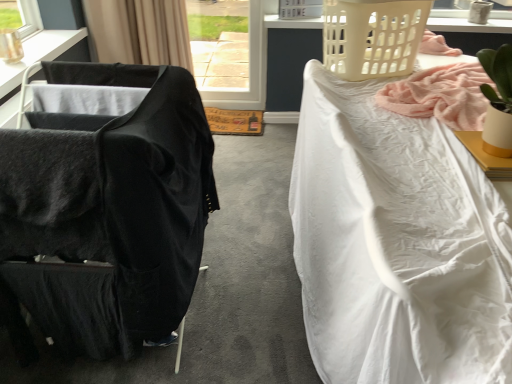
Where is `transparent glass door at center`? transparent glass door at center is located at coordinates tap(231, 55).

Find the location of a particular element. beige plastic laundry basket at upper right, the second basket viewed from the top is located at coordinates (372, 36).

Locate an element on the screen. black fabric chair at left is located at coordinates 105,209.

Image resolution: width=512 pixels, height=384 pixels. What do you see at coordinates (396, 244) in the screenshot? I see `white textured fabric at right` at bounding box center [396, 244].

This screenshot has width=512, height=384. Describe the element at coordinates (300, 9) in the screenshot. I see `white plastic laundry basket at upper center, which is the first basket from back to front` at that location.

The width and height of the screenshot is (512, 384). Identify the location of black fabric curtain at upper left. (139, 32).

Find the location of `transparent glass door at center`. transparent glass door at center is located at coordinates (231, 55).

Is transparent glass door at center at the back of white textured fabric at right?

No, white textured fabric at right is not facing away from transparent glass door at center.

Considering the positions of objects white textured fabric at right and transparent glass door at center in the image provided, who is more to the left, white textured fabric at right or transparent glass door at center?

From the viewer's perspective, transparent glass door at center appears more on the left side.

Can you tell me how much white textured fabric at right and transparent glass door at center differ in facing direction?

The angular difference between white textured fabric at right and transparent glass door at center is 89.1 degrees.

Which is correct: white textured fabric at right is inside transparent glass door at center, or outside of it?

white textured fabric at right is located beyond the bounds of transparent glass door at center.

Is white plastic laundry basket at upper center, the first basket in the top-to-bottom sequence, to the right of white textured fabric at right from the viewer's perspective?

Incorrect, white plastic laundry basket at upper center, the first basket in the top-to-bottom sequence, is not on the right side of white textured fabric at right.

Based on the photo, which of these two, white plastic laundry basket at upper center, the first basket in the top-to-bottom sequence, or white textured fabric at right, stands taller?

Standing taller between the two is white textured fabric at right.

In terms of width, does white plastic laundry basket at upper center, the first basket in the top-to-bottom sequence, look wider or thinner when compared to white textured fabric at right?

white plastic laundry basket at upper center, the first basket in the top-to-bottom sequence, is thinner than white textured fabric at right.

From the picture: How different are the orientations of white plastic laundry basket at upper center, the second basket from the front, and white textured fabric at right in degrees?

The facing directions of white plastic laundry basket at upper center, the second basket from the front, and white textured fabric at right are 71.8 degrees apart.

Can we say beige plastic laundry basket at upper right, the 1th basket from the front, lies outside white ceramic lamp at upper right, which appears as the 2th lamp when viewed from the left?

beige plastic laundry basket at upper right, the 1th basket from the front, lies outside white ceramic lamp at upper right, which appears as the 2th lamp when viewed from the left,'s area.

Between beige plastic laundry basket at upper right, the 1th basket from the front, and white ceramic lamp at upper right, the first lamp viewed from the back, which one appears on the left side from the viewer's perspective?

Positioned to the left is beige plastic laundry basket at upper right, the 1th basket from the front.

From a real-world perspective, is beige plastic laundry basket at upper right, which appears as the first basket when ordered from the bottom, on top of white ceramic lamp at upper right, which appears as the 2th lamp when viewed from the left?

Yes.

This screenshot has height=384, width=512. What are the coordinates of `window on the left of the white matte desk at upper right` in the screenshot? It's located at (231, 55).

Does transparent glass door at center come in front of white matte desk at upper right?

No, it is not.

Is transparent glass door at center in contact with white matte desk at upper right?

No, transparent glass door at center is not beside white matte desk at upper right.

From the image's perspective, is transparent glass door at center over white matte desk at upper right?

Indeed, from the image's perspective, transparent glass door at center is shown above white matte desk at upper right.

What are the coordinates of `the 2nd basket positioned above the black fabric curtain at upper left (from a real-world perspective)` in the screenshot? It's located at (372, 36).

From the image's perspective, is beige plastic laundry basket at upper right, the second basket viewed from the top, below black fabric curtain at upper left?

Indeed, from the image's perspective, beige plastic laundry basket at upper right, the second basket viewed from the top, is shown beneath black fabric curtain at upper left.

Between beige plastic laundry basket at upper right, which appears as the first basket when ordered from the bottom, and black fabric curtain at upper left, which one is positioned behind?

Positioned behind is black fabric curtain at upper left.

From the picture: Which of these two, beige plastic laundry basket at upper right, marked as the 2th basket in a back-to-front arrangement, or black fabric curtain at upper left, stands taller?

With more height is black fabric curtain at upper left.

Would you say beige plastic laundry basket at upper right, the 1th basket from the front, is inside or outside black fabric table at left?

beige plastic laundry basket at upper right, the 1th basket from the front, is located beyond the bounds of black fabric table at left.

Is beige plastic laundry basket at upper right, marked as the 2th basket in a back-to-front arrangement, not near black fabric table at left?

Yes, beige plastic laundry basket at upper right, marked as the 2th basket in a back-to-front arrangement, and black fabric table at left are quite far apart.

Considering the sizes of objects beige plastic laundry basket at upper right, which appears as the first basket when ordered from the bottom, and black fabric table at left in the image provided, who is wider, beige plastic laundry basket at upper right, which appears as the first basket when ordered from the bottom, or black fabric table at left?

With larger width is beige plastic laundry basket at upper right, which appears as the first basket when ordered from the bottom.

What's the angular difference between beige plastic laundry basket at upper right, marked as the 2th basket in a back-to-front arrangement, and black fabric table at left's facing directions?

beige plastic laundry basket at upper right, marked as the 2th basket in a back-to-front arrangement, and black fabric table at left are facing 0.279 degrees away from each other.

Image resolution: width=512 pixels, height=384 pixels. I want to click on lamp located below the beige plastic laundry basket at upper right, which appears as the first basket when ordered from the bottom (from the image's perspective), so click(x=10, y=46).

Between beige plastic laundry basket at upper right, the 1th basket from the front, and metallic gold lamp at upper left, acting as the second lamp starting from the right, which one is positioned in front?

Positioned in front is beige plastic laundry basket at upper right, the 1th basket from the front.

Is beige plastic laundry basket at upper right, marked as the 2th basket in a back-to-front arrangement, to the left of metallic gold lamp at upper left, the first lamp viewed from the front, from the viewer's perspective?

Incorrect, beige plastic laundry basket at upper right, marked as the 2th basket in a back-to-front arrangement, is not on the left side of metallic gold lamp at upper left, the first lamp viewed from the front.

Identify the location of bed to the right of transparent glass door at center. (396, 244).

The width and height of the screenshot is (512, 384). Find the location of `bed in front of the white plastic laundry basket at upper center, which is the first basket from back to front`. bed in front of the white plastic laundry basket at upper center, which is the first basket from back to front is located at coordinates (396, 244).

Based on their spatial positions, is white ceramic lamp at upper right, the 2th lamp positioned from the bottom, or black fabric chair at left closer to metallic gold lamp at upper left, acting as the second lamp starting from the right?

black fabric chair at left is positioned closer to the anchor metallic gold lamp at upper left, acting as the second lamp starting from the right.

Which object lies further to the anchor point black fabric table at left, black fabric chair at left or white ceramic lamp at upper right, the first lamp viewed from the back?

white ceramic lamp at upper right, the first lamp viewed from the back, is positioned further to the anchor black fabric table at left.

Which object lies nearer to the anchor point beige plastic laundry basket at upper right, marked as the 2th basket in a back-to-front arrangement, black fabric curtain at upper left or white matte desk at upper right?

white matte desk at upper right lies closer to beige plastic laundry basket at upper right, marked as the 2th basket in a back-to-front arrangement, than the other object.

Looking at the image, which one is located closer to white ceramic lamp at upper right, the first lamp viewed from the back, white textured fabric at right or white matte desk at upper right?

The object closer to white ceramic lamp at upper right, the first lamp viewed from the back, is white matte desk at upper right.

From the image, which object appears to be nearer to white plastic laundry basket at upper center, the second basket from the front, transparent glass door at center or black fabric chair at left?

black fabric chair at left.

When comparing their distances from white plastic laundry basket at upper center, the second basket from the front, does black fabric chair at left or white ceramic lamp at upper right, the first lamp viewed from the back, seem further?

black fabric chair at left is further to white plastic laundry basket at upper center, the second basket from the front.

From the image, which object appears to be nearer to metallic gold lamp at upper left, the second lamp in the back-to-front sequence, white plastic laundry basket at upper center, the second basket positioned from the bottom, or white textured fabric at right?

Among the two, white plastic laundry basket at upper center, the second basket positioned from the bottom, is located nearer to metallic gold lamp at upper left, the second lamp in the back-to-front sequence.

Estimate the real-world distances between objects in this image. Which object is closer to black fabric curtain at upper left, white textured fabric at right or beige plastic laundry basket at upper right, marked as the 2th basket in a back-to-front arrangement?

Among the two, beige plastic laundry basket at upper right, marked as the 2th basket in a back-to-front arrangement, is located nearer to black fabric curtain at upper left.

Where is `window between metallic gold lamp at upper left, the second lamp in the back-to-front sequence, and white matte desk at upper right`? This screenshot has height=384, width=512. window between metallic gold lamp at upper left, the second lamp in the back-to-front sequence, and white matte desk at upper right is located at coordinates click(x=231, y=55).

Locate an element on the screen. The image size is (512, 384). curtain between black fabric table at left and white plastic laundry basket at upper center, which is the first basket from back to front, from left to right is located at coordinates (139, 32).

The image size is (512, 384). What are the coordinates of `curtain between black fabric table at left and white textured fabric at right` in the screenshot? It's located at (139, 32).

Find the location of a particular element. The width and height of the screenshot is (512, 384). desk located between black fabric chair at left and white textured fabric at right in the left-right direction is located at coordinates (486, 156).